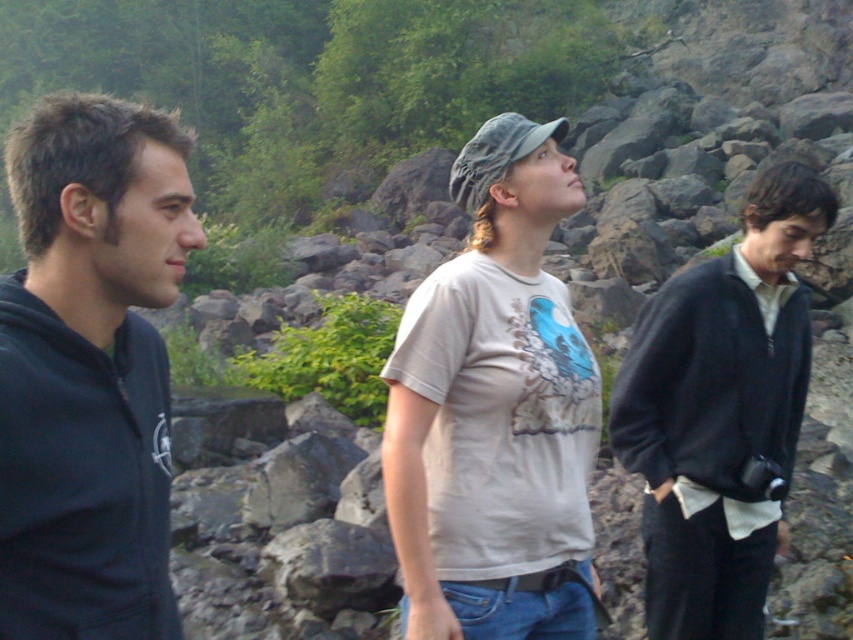
Can you confirm if light beige t-shirt at center is taller than dark blue fleece at right?

Indeed, light beige t-shirt at center has a greater height compared to dark blue fleece at right.

From the picture: Is light beige t-shirt at center to the right of dark blue fleece at right from the viewer's perspective?

Incorrect, light beige t-shirt at center is not on the right side of dark blue fleece at right.

Does point (456, 326) come in front of point (692, 273)?

Yes, it is in front of point (692, 273).

At what (x,y) coordinates should I click in order to perform the action: click on light beige t-shirt at center. Please return your answer as a coordinate pair (x, y). Looking at the image, I should click on (495, 410).

Can you confirm if light gray cotton t-shirt at center is shorter than dark blue sweater at right?

Yes.

Does light gray cotton t-shirt at center appear under dark blue sweater at right?

No, light gray cotton t-shirt at center is not below dark blue sweater at right.

Is point (534, 131) closer to camera compared to point (761, 412)?

Yes, point (534, 131) is in front of point (761, 412).

This screenshot has width=853, height=640. I want to click on light gray cotton t-shirt at center, so click(x=494, y=410).

Is dark blue sweater at right positioned before dark blue fleece at right?

Yes, it is.

What do you see at coordinates (721, 412) in the screenshot? I see `dark blue sweater at right` at bounding box center [721, 412].

What are the coordinates of `dark blue sweater at right` in the screenshot? It's located at (721, 412).